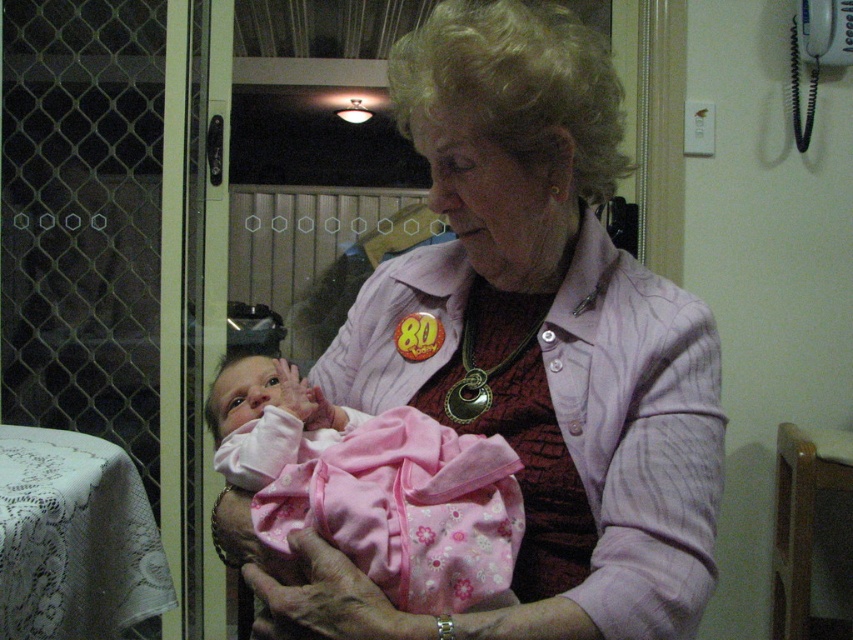
You are a photographer setting up for a birthday photo session. You need to ensure the pink fabric at center and the pink fleece baby at center are both visible in the frame. Considering their sizes, which object should you focus on to ensure the baby is clearly visible?

The pink fabric at center is larger than the pink fleece baby at center. To ensure the baby is clearly visible, focus on the pink fleece baby at center since it is smaller and requires attention to detail for clarity.

You are a photographer standing at a distance from the elderly woman holding the baby. You want to take a closeup photo of the baby. The point where you need to focus your camera is located at point (540, 576). If the recommended focusing distance for a clear closeup is 36 inches, is the current distance sufficient?

The point (540, 576) and the viewer are 36.12 inches apart, which is slightly more than the recommended 36 inches. The distance is almost sufficient, but to ensure a clear closeup, moving just a tiny bit closer would be advisable.